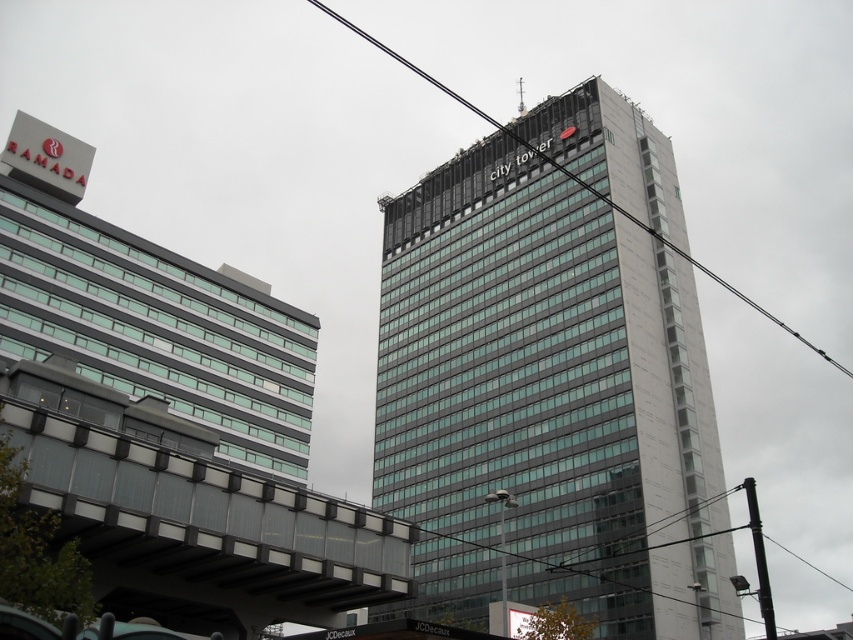
You are standing in the middle of the street looking at the two buildings. There are two points marked on the buildings. The first point is at coordinates point (514,138) and the second is at point (772,634). Which point is closer to you?

Point (514,138) is closer to you because it is further to the camera than point (772,634).